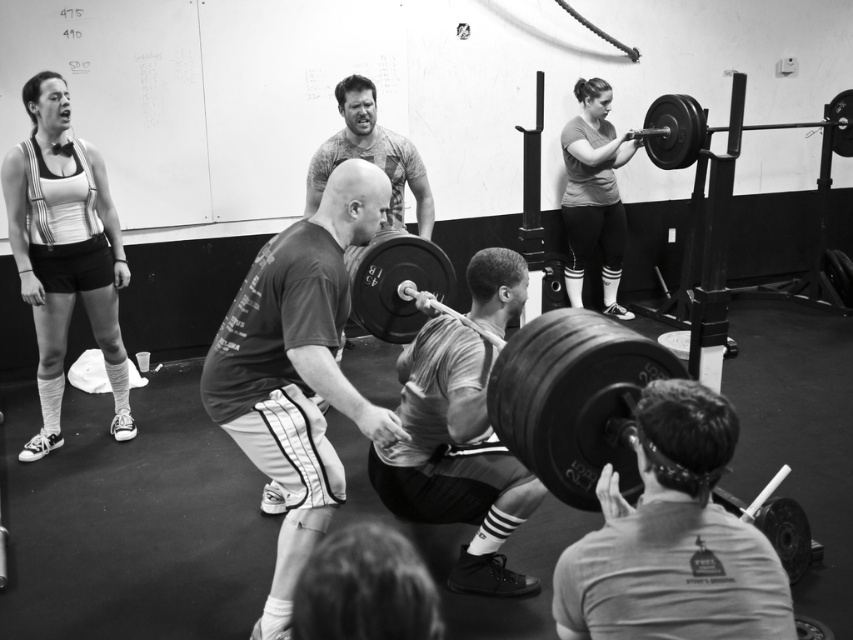
Question: Can you confirm if smooth gray shirt at center is bigger than printed fabric shirt at center?

Choices:
 (A) yes
 (B) no

Answer: (A)

Question: Among these objects, which one is nearest to the camera?

Choices:
 (A) printed fabric shirt at center
 (B) dark gray t-shirt at center
 (C) black rubber barbell at center
 (D) matte white tank top at left

Answer: (B)

Question: Which of the following is the closest to the observer?

Choices:
 (A) black rubber barbell at upper right
 (B) smooth black barbell at center
 (C) smooth gray shirt at center
 (D) matte gray shirt at center

Answer: (B)

Question: Is matte gray shirt at center closer to camera compared to black rubber barbell at center?

Choices:
 (A) yes
 (B) no

Answer: (B)

Question: Can you confirm if smooth black barbell at center is thinner than black rubber barbell at upper right?

Choices:
 (A) no
 (B) yes

Answer: (B)

Question: Which of the following is the closest to the observer?

Choices:
 (A) black rubber barbell at upper right
 (B) smooth skin squat at lower center
 (C) dark gray t-shirt at center
 (D) smooth black barbell at center

Answer: (D)